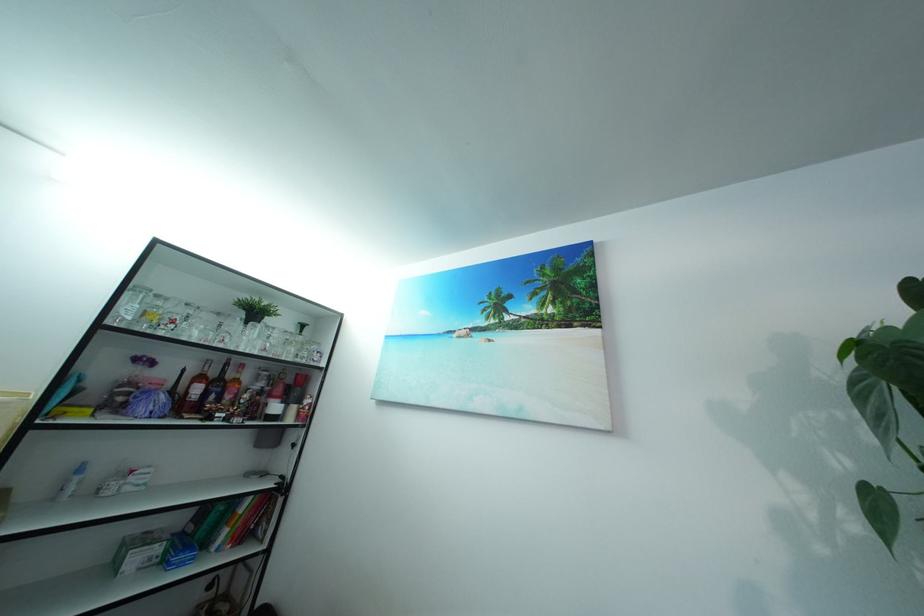
Find the location of a particular element. The width and height of the screenshot is (924, 616). red shaker bottle is located at coordinates (274, 398).